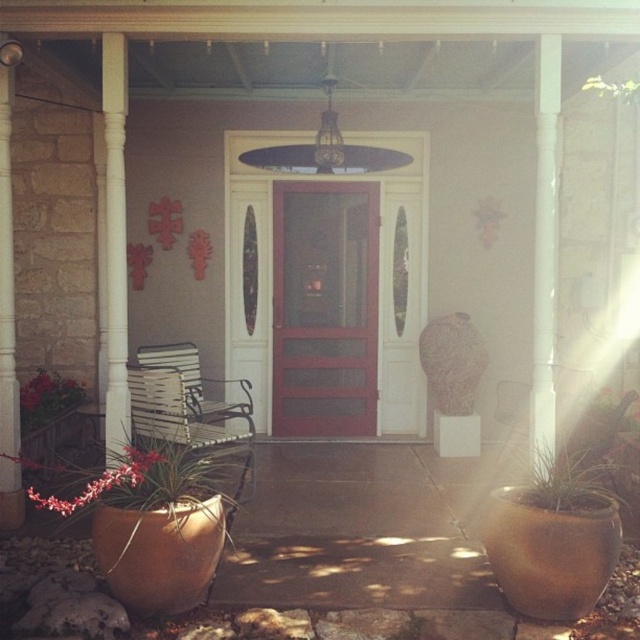
Question: Is matte terracotta pot at lower left bigger than green matte plant at lower right?

Choices:
 (A) no
 (B) yes

Answer: (B)

Question: Which point is farther from the camera taking this photo?

Choices:
 (A) (312, 275)
 (B) (589, 500)
 (C) (8, 144)
 (D) (67, 483)

Answer: (A)

Question: Which is farther from the matte red door at center?

Choices:
 (A) green leafy plant at lower left
 (B) white painted wood column at left

Answer: (B)

Question: Can you confirm if matte red door at center is thinner than green leafy plant at lower left?

Choices:
 (A) yes
 (B) no

Answer: (B)

Question: Considering the relative positions of matte wood door at center and matte red door at center in the image provided, where is matte wood door at center located with respect to matte red door at center?

Choices:
 (A) left
 (B) right

Answer: (A)

Question: Estimate the real-world distances between objects in this image. Which object is farther from the green leafy plant at lower left?

Choices:
 (A) white painted wood column at left
 (B) matte wood door at center
 (C) green matte plant at lower right
 (D) matte red door at center

Answer: (C)